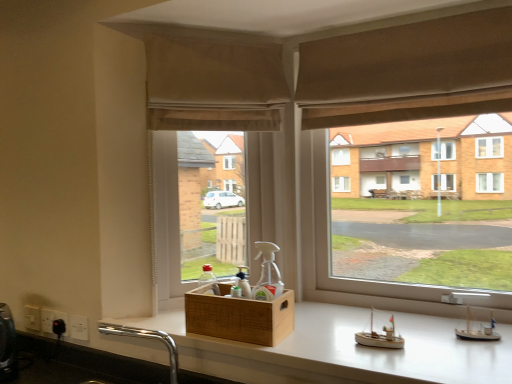
The width and height of the screenshot is (512, 384). In order to click on vacant space situated above brown fabric curtain at upper center (from a real-world perspective) in this screenshot , I will do `click(407, 15)`.